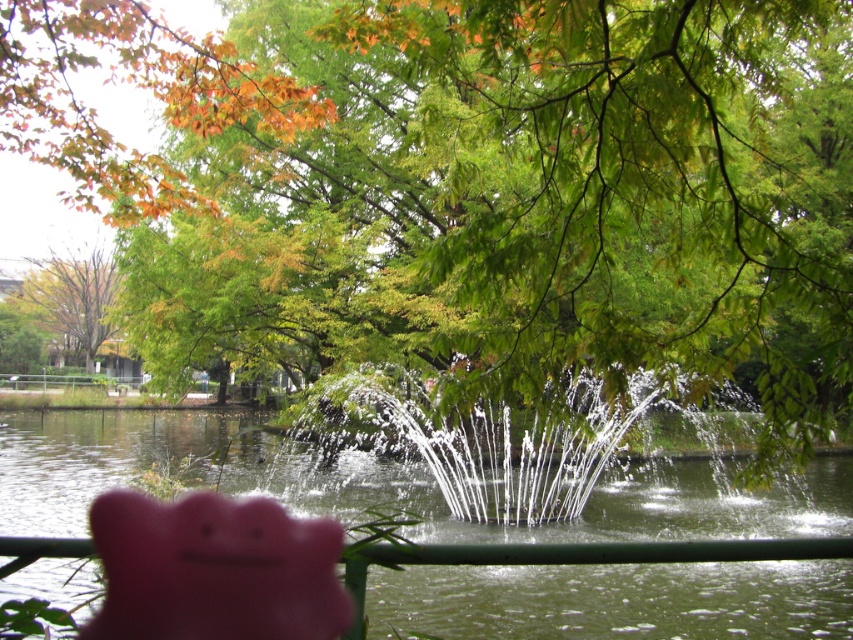
Between point (244, 570) and point (38, 296), which one is positioned behind?

Positioned behind is point (38, 296).

Is pink rubber piggy bank at lower center bigger than green leafy tree at upper left?

No, pink rubber piggy bank at lower center is not bigger than green leafy tree at upper left.

Is point (245, 609) farther from camera compared to point (45, 275)?

No.

This screenshot has width=853, height=640. In order to click on pink rubber piggy bank at lower center in this screenshot , I will do `click(213, 570)`.

Between clear water at fountain center and pink rubber piggy bank at lower center, which one has more height?

clear water at fountain center

Can you confirm if clear water at fountain center is wider than pink rubber piggy bank at lower center?

Indeed, clear water at fountain center has a greater width compared to pink rubber piggy bank at lower center.

Which is in front, point (381, 636) or point (134, 563)?

Point (134, 563) is in front.

Locate an element on the screen. clear water at fountain center is located at coordinates (381, 483).

Which is behind, point (700, 605) or point (91, 356)?

Point (91, 356)

Is point (144, 440) farther from viewer compared to point (80, 273)?

That is False.

Does point (309, 472) come closer to viewer compared to point (91, 356)?

Yes, it is in front of point (91, 356).

Where is `clear water at fountain center`? This screenshot has height=640, width=853. clear water at fountain center is located at coordinates (381, 483).